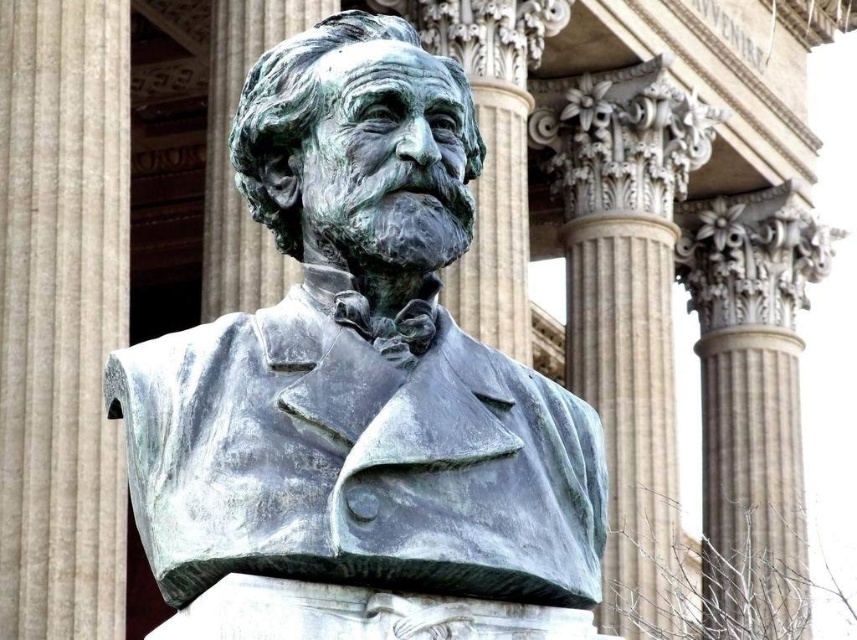
You are an architect examining the classical building in the scene. You notice two columns in the center area. Which one is shorter between the green patina stone pillar at center and the smooth stone column at center?

The green patina stone pillar at center is shorter than the smooth stone column at center according to the description.

You are an architect examining the classical building in the image. You notice the green patina stone pillar at center and the smooth stone column at center. Which of these two structures is positioned higher in the image?

The green patina stone pillar at center is located above the smooth stone column at center, so it is positioned higher in the image.

From the picture: You are an architect designing a new garden layout and need to place the smooth stone column at center and the green patina stone bust at center next to each other. Which object should you place first if you want to ensure there is enough space for both, considering their widths?

You should place the smooth stone column at center first since it has a lesser width compared to the green patina stone bust at center, allowing more flexibility in arranging the wider bust next to it.